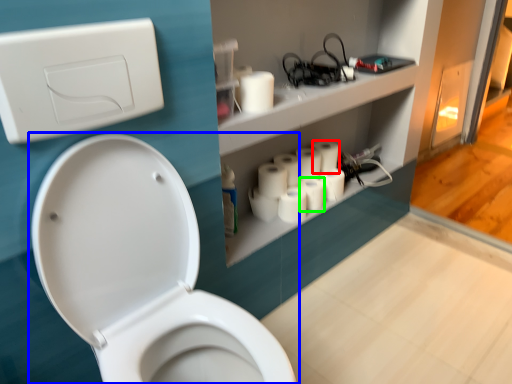
Question: Considering the real-world distances, which object is closest to toilet paper (highlighted by a red box)? toilet (highlighted by a blue box) or toilet paper (highlighted by a green box).

Choices:
 (A) toilet
 (B) toilet paper

Answer: (B)